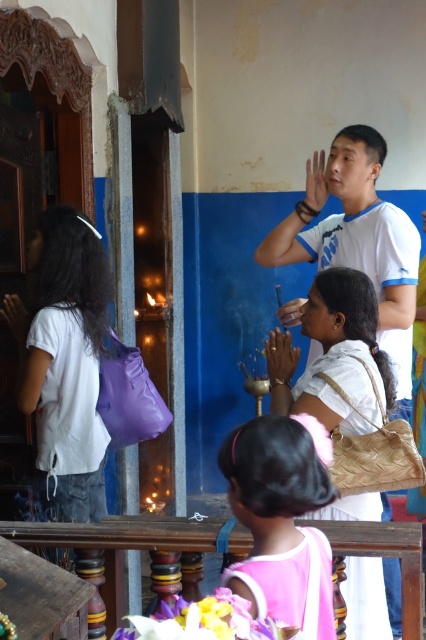
You are an interior designer planning to place a new decorative item in the temple scene. The pink fabric dress at lower center and the beige woven bag at center are already present. Which object should you avoid placing a large statue next to if you want to maintain visual balance?

You should avoid placing the large statue next to the pink fabric dress at lower center because it is larger in size than the beige woven bag at center, and adding another large object nearby could disrupt the balance.

You are an interior designer assessing the temple layout. You notice the pink fabric dress at lower center and beige woven bag at center. Which object is shorter in height?

The pink fabric dress at lower center is shorter in height compared to the beige woven bag at center.

You are standing in a temple and see a young girl in a pink sleeveless top and a white bag. There is a point marked at coordinates (282,520) in the image. What object is located at that point?

The point at coordinates (282,520) marks the pink fabric dress at lower center.